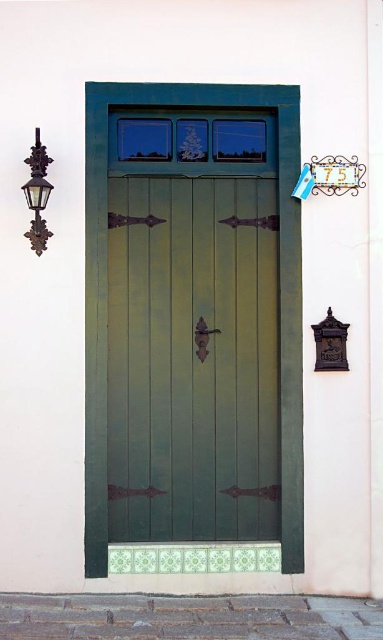
You are a delivery person trying to reach the doorbell mounted on the green painted wood door at center. The doorbell is at the same height as the top of the matte black lantern at left. Can you reach it without a ladder?

The green painted wood door at center is taller than the matte black lantern at left. Since the doorbell is at the top of the lantern, which is shorter than the door, you might need to check the doorbell height relative to your reach. If the door is significantly taller, the doorbell could be higher than your reach. However, without knowing the exact height difference, it is uncertain. But according to the description, the door is taller, so the doorbell might be higher than the lantern. If the lantern is,

You are standing in front of the building and want to touch both the green painted wood door at center and the matte black lantern at left. Which object will require you to take a step forward to reach?

The green painted wood door at center is closer to you than the matte black lantern at left, so you will need to take a step forward to reach the matte black lantern at left.